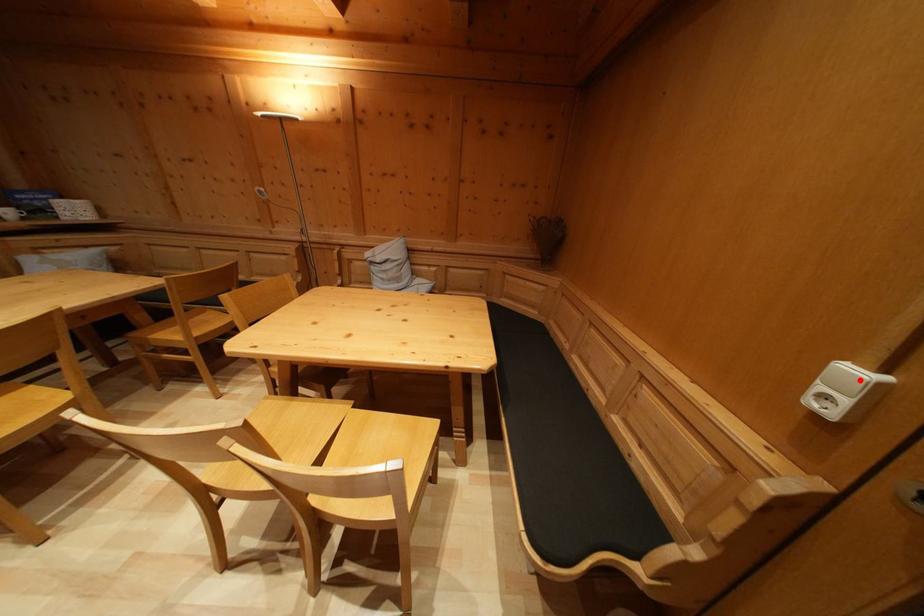
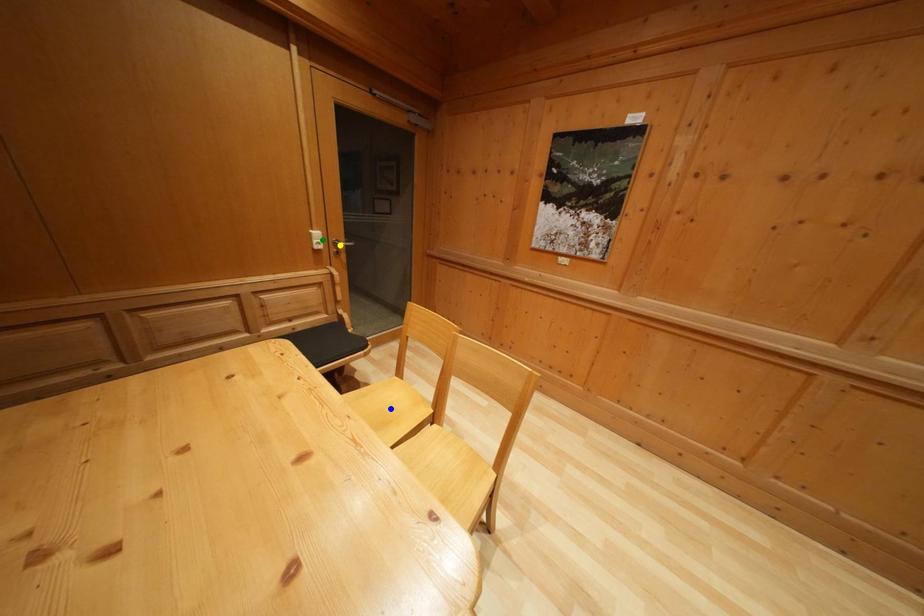
Question: I am providing you with two images of the same scene from different viewpoints. A red point is marked on the first image. You are given multiple points on the second image. Can you choose the point in image 2 that corresponds to the point in image 1?

Choices:
 (A) yellow point
 (B) green point
 (C) blue point

Answer: (B)